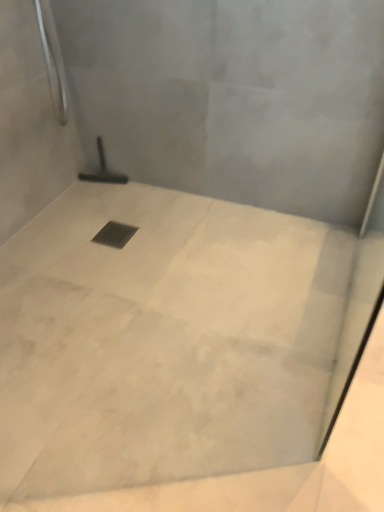
I want to click on white marble floor at center, so click(x=170, y=347).

Between white marble floor at center and black rubber squeegee at center, which one appears on the left side from the viewer's perspective?

Positioned to the left is black rubber squeegee at center.

From the image's perspective, relative to black rubber squeegee at center, is white marble floor at center above or below?

Clearly, from the image's perspective, white marble floor at center is below black rubber squeegee at center.

Consider the image. Is white marble floor at center positioned beyond the bounds of black rubber squeegee at center?

Yes, white marble floor at center is outside of black rubber squeegee at center.

Which of these two, white marble floor at center or black rubber squeegee at center, stands shorter?

Standing shorter between the two is white marble floor at center.

This screenshot has height=512, width=384. What are the coordinates of `shower behind the black metal drain at center` in the screenshot? It's located at (103, 170).

How distant is black metal drain at center from black rubber squeegee at center?

black metal drain at center is 13.35 inches from black rubber squeegee at center.

Which point is more distant from viewer, (131, 226) or (106, 180)?

The point (106, 180) is farther.

From the image's perspective, which one is positioned higher, black metal drain at center or black rubber squeegee at center?

black rubber squeegee at center, from the image's perspective.

Looking at this image, considering the sizes of objects white marble floor at center and black metal drain at center in the image provided, who is taller, white marble floor at center or black metal drain at center?

With more height is white marble floor at center.

Can you confirm if white marble floor at center is wider than black metal drain at center?

Yes.

Is white marble floor at center further to the viewer compared to black metal drain at center?

No, white marble floor at center is closer to the viewer.

Is the position of black rubber squeegee at center more distant than that of black metal drain at center?

Yes, it is behind black metal drain at center.

Considering the sizes of objects black rubber squeegee at center and black metal drain at center in the image provided, who is shorter, black rubber squeegee at center or black metal drain at center?

black metal drain at center.

Looking at their sizes, would you say black rubber squeegee at center is wider or thinner than black metal drain at center?

black rubber squeegee at center is thinner than black metal drain at center.

Is point (114, 175) closer to viewer compared to point (128, 234)?

No, (114, 175) is behind (128, 234).

Is the position of black metal drain at center less distant than that of white marble floor at center?

That is False.

Is black metal drain at center at the right side of white marble floor at center?

No, black metal drain at center is not to the right of white marble floor at center.

From the image's perspective, relative to white marble floor at center, is black metal drain at center above or below?

black metal drain at center is situated higher than white marble floor at center in the image.

From a real-world perspective, is black metal drain at center physically located above or below white marble floor at center?

black metal drain at center is below white marble floor at center.

Is black rubber squeegee at center completely or partially outside of white marble floor at center?

Yes.

Between black rubber squeegee at center and white marble floor at center, which one has larger width?

white marble floor at center is wider.

Between black rubber squeegee at center and white marble floor at center, which one appears on the left side from the viewer's perspective?

From the viewer's perspective, black rubber squeegee at center appears more on the left side.

The image size is (384, 512). Find the location of `shower above the white marble floor at center (from the image's perspective)`. shower above the white marble floor at center (from the image's perspective) is located at coordinates [x=103, y=170].

The height and width of the screenshot is (512, 384). What are the coordinates of `concrete on the right side of black rubber squeegee at center` in the screenshot? It's located at coord(170,347).

Locate an element on the screen. drain below the black rubber squeegee at center (from the image's perspective) is located at coordinates (115, 234).

Considering their positions, is black metal drain at center positioned closer to white marble floor at center than black rubber squeegee at center?

black metal drain at center lies closer to white marble floor at center than the other object.

From the picture: From the image, which object appears to be farther from black metal drain at center, white marble floor at center or black rubber squeegee at center?

white marble floor at center lies further to black metal drain at center than the other object.

Estimate the real-world distances between objects in this image. Which object is closer to black rubber squeegee at center, white marble floor at center or black metal drain at center?

black metal drain at center is closer to black rubber squeegee at center.

When comparing their distances from white marble floor at center, does black rubber squeegee at center or black metal drain at center seem closer?

black metal drain at center is positioned closer to the anchor white marble floor at center.

From the image, which object appears to be nearer to black metal drain at center, black rubber squeegee at center or white marble floor at center?

Based on the image, black rubber squeegee at center appears to be nearer to black metal drain at center.

When comparing their distances from black rubber squeegee at center, does black metal drain at center or white marble floor at center seem closer?

Among the two, black metal drain at center is located nearer to black rubber squeegee at center.

Identify the location of drain between white marble floor at center and black rubber squeegee at center in the front-back direction. The height and width of the screenshot is (512, 384). (115, 234).